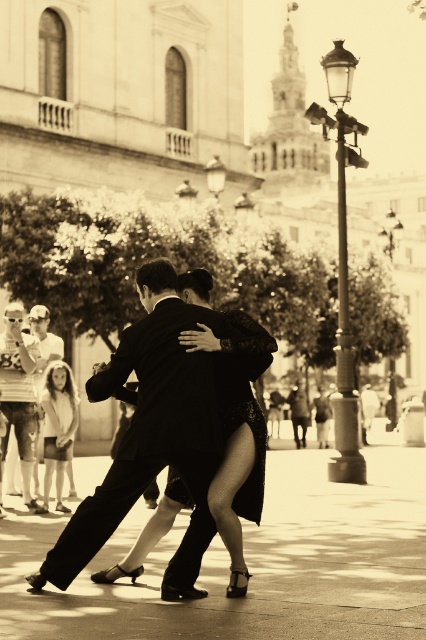
You are a photographer at the event and want to capture a closeup of the black lace dress at center and the matte black suit at left. Since your camera has a limited focus range, which object should you focus on to ensure it appears sharp in the photo?

The black lace dress at center is larger in size than matte black suit at left, so focusing on the black lace dress at center will ensure it appears sharp since it takes up more of the frame.

You are standing at the center of the image. Which direction should you move to reach the matte black suit at left?

Since the matte black suit at left is located at point 0.611 on the x axis and 0.045 on the y axis, you should move to the left and down to reach it.

From the picture: You are a photographer standing in the scene. You need to capture a photo of the matte black suit at left and the light beige fabric dress at lower left. Which one will appear larger in the photo?

The matte black suit at left will appear larger in the photo because it is much taller than the light beige fabric dress at lower left.